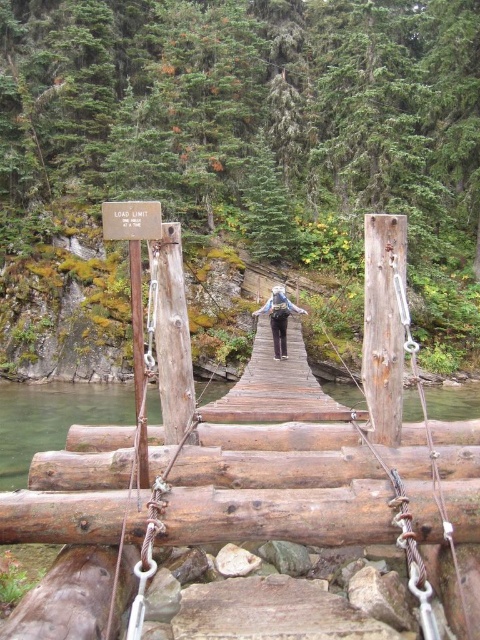
Question: Which point is closer to the camera taking this photo?

Choices:
 (A) (269, 321)
 (B) (98, 522)
 (C) (436, 408)

Answer: (B)

Question: In this image, where is greenish-brown wood at center located relative to matte gray backpack at center?

Choices:
 (A) left
 (B) right

Answer: (B)

Question: Can you confirm if greenish-brown wood at center is smaller than matte gray backpack at center?

Choices:
 (A) no
 (B) yes

Answer: (A)

Question: Does brown wooden bridge at center lie in front of greenish-brown wood at center?

Choices:
 (A) no
 (B) yes

Answer: (B)

Question: Which object is the closest to the matte gray backpack at center?

Choices:
 (A) brown wooden bridge at center
 (B) greenish-brown wood at center

Answer: (A)

Question: Which point is closer to the camera?

Choices:
 (A) brown wooden bridge at center
 (B) greenish-brown wood at center

Answer: (A)